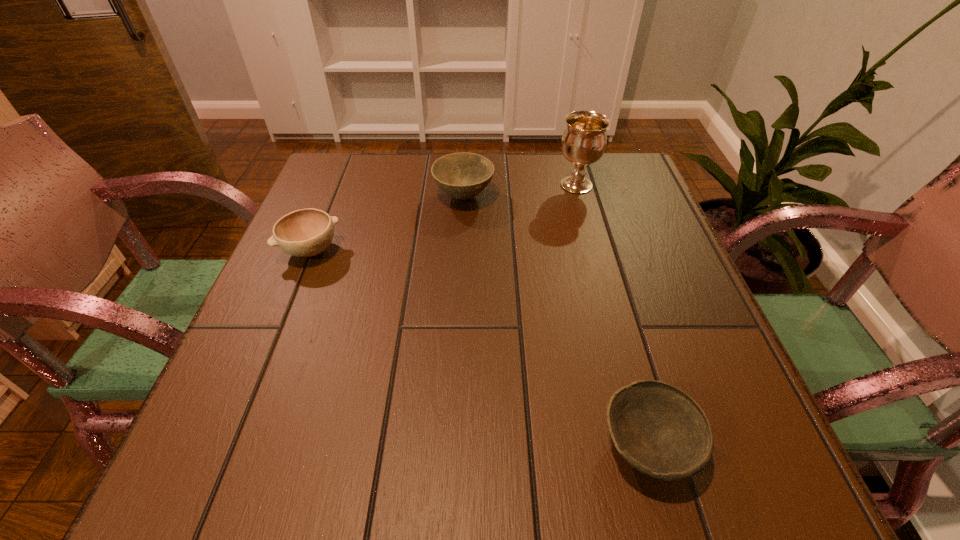
In the image, there is a desktop. Where is `vacant space at the near edge`? Image resolution: width=960 pixels, height=540 pixels. vacant space at the near edge is located at coordinates (481, 440).

The image size is (960, 540). What are the coordinates of `vacant space at the left edge of the desktop` in the screenshot? It's located at (302, 404).

In the image, there is a desktop. In order to click on free space at the right edge in this screenshot , I will do `click(639, 255)`.

Identify the location of vacant space at the near left corner of the desktop. (299, 446).

Where is `free space at the far right corner of the desktop`? Image resolution: width=960 pixels, height=540 pixels. free space at the far right corner of the desktop is located at coordinates point(615,184).

You are a GUI agent. You are given a task and a screenshot of the screen. Output one action in this format:
    pyautogui.click(x=<x>, y=<y>)
    Task: Click on the vacant space that's between the leftmost bowl and the rightmost bowl
    
    Given the screenshot: What is the action you would take?
    pyautogui.click(x=480, y=348)

Identify the location of unoccupied area between the rightmost bowl and the leftmost object. The height and width of the screenshot is (540, 960). (480, 348).

Identify the location of blank region between the third object from right to left and the chalice. (520, 191).

Locate an element on the screen. The height and width of the screenshot is (540, 960). vacant space that's between the second nearest bowl and the farthest bowl is located at coordinates (387, 224).

Identify the location of free spot between the farthest bowl and the leftmost bowl. The image size is (960, 540). (387, 224).